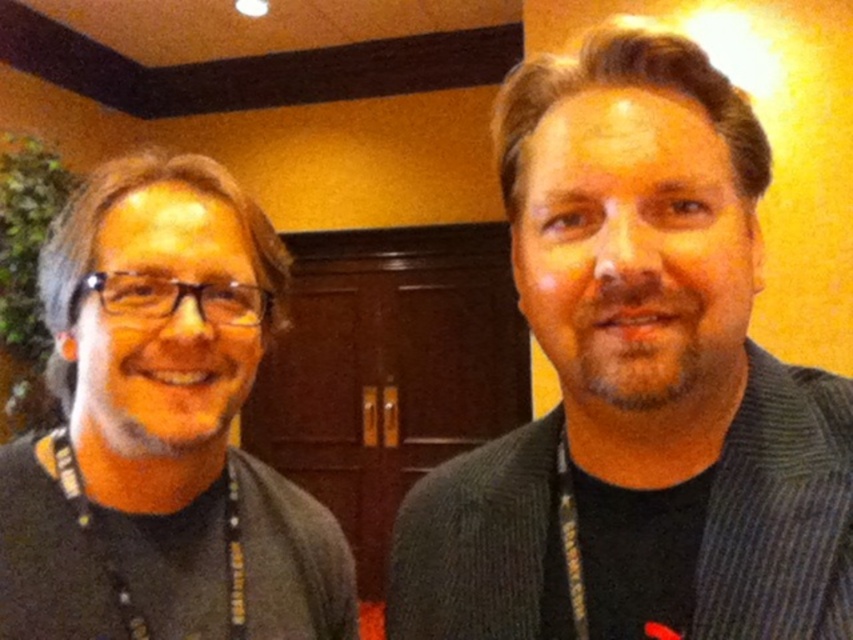
Question: Which point is farther from the camera taking this photo?

Choices:
 (A) (22, 589)
 (B) (509, 593)

Answer: (A)

Question: Considering the relative positions of dark gray sweater at right and matte black glasses at left in the image provided, where is dark gray sweater at right located with respect to matte black glasses at left?

Choices:
 (A) right
 (B) left

Answer: (A)

Question: Is dark gray sweater at right thinner than matte black glasses at left?

Choices:
 (A) no
 (B) yes

Answer: (A)

Question: Does dark gray sweater at right have a lesser width compared to matte black glasses at left?

Choices:
 (A) no
 (B) yes

Answer: (A)

Question: Which point is closer to the camera?

Choices:
 (A) (589, 515)
 (B) (293, 577)

Answer: (A)